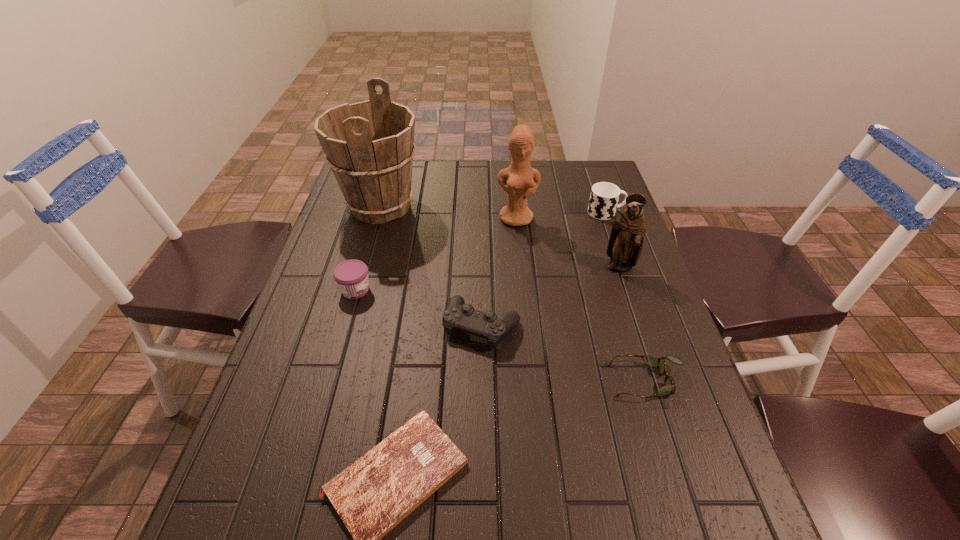
The height and width of the screenshot is (540, 960). I want to click on bucket, so click(369, 145).

Locate an element on the screen. Image resolution: width=960 pixels, height=540 pixels. the farther figurine is located at coordinates (522, 180).

I want to click on the second tallest object, so click(x=522, y=180).

The width and height of the screenshot is (960, 540). I want to click on the shorter figurine, so click(625, 244).

In order to click on the nearer figurine in this screenshot , I will do `click(625, 244)`.

Where is `the fourth tallest object`? The width and height of the screenshot is (960, 540). the fourth tallest object is located at coordinates (604, 197).

The width and height of the screenshot is (960, 540). Identify the location of jam. (351, 276).

The image size is (960, 540). What are the coordinates of `the third nearest object` in the screenshot? It's located at (457, 315).

The width and height of the screenshot is (960, 540). I want to click on spectacles, so click(x=669, y=387).

Identify the location of the second shortest object. This screenshot has width=960, height=540. (669, 387).